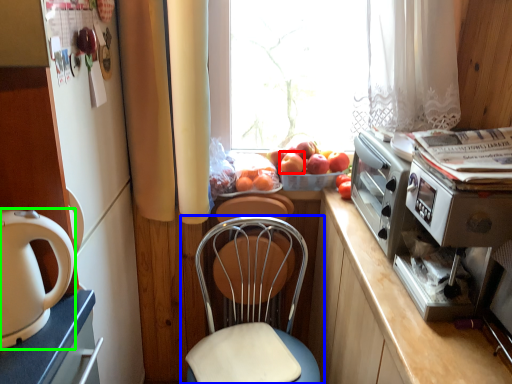
Question: Which object is the closest to the apple (highlighted by a red box)? Choose among these: chair (highlighted by a blue box) or home appliance (highlighted by a green box).

Choices:
 (A) chair
 (B) home appliance

Answer: (A)